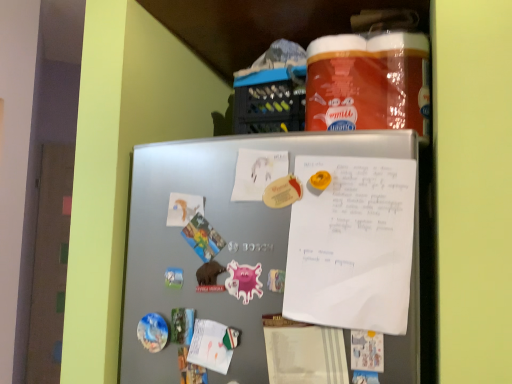
In order to face white paper at upper center, should I rotate leftwards or rightwards?

You should rotate right by 12.369 degrees.

What is the approximate height of white matte paper at upper left, which is the 1th paper in left-to-right order?

The height of white matte paper at upper left, which is the 1th paper in left-to-right order, is 3.08 inches.

Image resolution: width=512 pixels, height=384 pixels. I want to click on white matte paper at upper left, which is the 1th paper in left-to-right order, so click(x=183, y=208).

You are a GUI agent. You are given a task and a screenshot of the screen. Output one action in this format:
    pyautogui.click(x=<x>, y=<y>)
    Task: Click on the white matte paper at center, the 1th paper when ordered from top to bottom
    
    Given the screenshot: What is the action you would take?
    pyautogui.click(x=257, y=172)

You are a GUI agent. You are given a task and a screenshot of the screen. Output one action in this format:
    pyautogui.click(x=<x>, y=<y>)
    Task: Click on the white paper at upper center
    This screenshot has width=512, height=384.
    Given the screenshot: What is the action you would take?
    pyautogui.click(x=352, y=244)

From the image's perspective, between satin silver fridge at center and white paper at upper center, which one is located above?

white paper at upper center appears higher in the image.

Relative to white paper at upper center, is satin silver fridge at center in front or behind?

satin silver fridge at center is positioned closer to the viewer than white paper at upper center.

Are satin silver fridge at center and white paper at upper center beside each other?

There is a gap between satin silver fridge at center and white paper at upper center.

Is satin silver fridge at center spatially inside white paper at upper center, or outside of it?

satin silver fridge at center exists outside the volume of white paper at upper center.

Is the position of white matte paper at center, the 1th paper when ordered from top to bottom, less distant than that of white matte paper at upper left, which is the 1th paper in left-to-right order?

Yes, white matte paper at center, the 1th paper when ordered from top to bottom, is closer to the camera.

Image resolution: width=512 pixels, height=384 pixels. I want to click on paper that is in front of the white matte paper at upper left, which is counted as the 1th paper, starting from the bottom, so click(257, 172).

In the scene shown: Measure the distance from white matte paper at center, acting as the 2th paper starting from the left, to white matte paper at upper left, the 2th paper when ordered from top to bottom.

The distance of white matte paper at center, acting as the 2th paper starting from the left, from white matte paper at upper left, the 2th paper when ordered from top to bottom, is 4.84 inches.

Are white matte paper at center, acting as the second paper starting from the bottom, and white matte paper at upper left, which is the 1th paper in left-to-right order, located far from each other?

No, there isn't a large distance between white matte paper at center, acting as the second paper starting from the bottom, and white matte paper at upper left, which is the 1th paper in left-to-right order.

Does white matte paper at center, the 1th paper when ordered from top to bottom, have a smaller size compared to satin silver fridge at center?

Yes.

Does white matte paper at center, the 1th paper when ordered from top to bottom, lie behind satin silver fridge at center?

That is True.

Is white matte paper at center, the 1th paper when ordered from top to bottom, looking in the opposite direction of satin silver fridge at center?

Yes, white matte paper at center, the 1th paper when ordered from top to bottom,'s orientation is away from satin silver fridge at center.

Is white paper at upper center shorter than white matte paper at upper left, which is counted as the 1th paper, starting from the bottom?

No.

Are white paper at upper center and white matte paper at upper left, the 2th paper when ordered from top to bottom, beside each other?

No, white paper at upper center is not in contact with white matte paper at upper left, the 2th paper when ordered from top to bottom.

Is white matte paper at upper left, which is counted as the 1th paper, starting from the bottom, at the back of white paper at upper center?

That's not correct — white paper at upper center is not looking away from white matte paper at upper left, which is counted as the 1th paper, starting from the bottom.

From a real-world perspective, is white paper at upper center physically located above or below white matte paper at upper left, which appears as the second paper when viewed from the right?

white paper at upper center is below white matte paper at upper left, which appears as the second paper when viewed from the right.

In the scene shown: Is white paper at upper center taller than white matte paper at center, the 1th paper when ordered from top to bottom?

Yes.

Which is farther, (385, 214) or (245, 177)?

Positioned behind is point (245, 177).

Who is more distant, white paper at upper center or white matte paper at center, acting as the second paper starting from the bottom?

white matte paper at center, acting as the second paper starting from the bottom, is further from the camera.

Considering the sizes of objects white matte paper at upper left, the 2th paper when ordered from top to bottom, and white matte paper at center, acting as the 2th paper starting from the left, in the image provided, who is wider, white matte paper at upper left, the 2th paper when ordered from top to bottom, or white matte paper at center, acting as the 2th paper starting from the left,?

white matte paper at upper left, the 2th paper when ordered from top to bottom, is wider.

Who is more distant, white matte paper at upper left, which is counted as the 1th paper, starting from the bottom, or white matte paper at center, acting as the second paper starting from the bottom?

white matte paper at upper left, which is counted as the 1th paper, starting from the bottom, is more distant.

From a real-world perspective, is white matte paper at upper left, which is the 1th paper in left-to-right order, positioned above or below white matte paper at center, acting as the second paper starting from the bottom?

In terms of real-world spatial position, white matte paper at upper left, which is the 1th paper in left-to-right order, is below white matte paper at center, acting as the second paper starting from the bottom.

Is white matte paper at upper left, which appears as the second paper when viewed from the right, turned away from white matte paper at center, the first paper from the right?

No, white matte paper at center, the first paper from the right, is not at the back of white matte paper at upper left, which appears as the second paper when viewed from the right.

Looking at this image, considering the sizes of white paper at upper center and satin silver fridge at center in the image, is white paper at upper center bigger or smaller than satin silver fridge at center?

Clearly, white paper at upper center is smaller in size than satin silver fridge at center.

Which is in front, white paper at upper center or satin silver fridge at center?

satin silver fridge at center is closer to the camera.

From the image's perspective, would you say white paper at upper center is positioned over satin silver fridge at center?

Indeed, from the image's perspective, white paper at upper center is shown above satin silver fridge at center.

Could you tell me if white paper at upper center is facing satin silver fridge at center?

Answer: Yes, white paper at upper center is oriented towards satin silver fridge at center.

Where is `refrigerator below the white paper at upper center (from a real-world perspective)`? The width and height of the screenshot is (512, 384). refrigerator below the white paper at upper center (from a real-world perspective) is located at coordinates click(221, 234).

Locate an element on the screen. Image resolution: width=512 pixels, height=384 pixels. paper on the right of white matte paper at upper left, which is the 1th paper in left-to-right order is located at coordinates (257, 172).

Estimate the real-world distances between objects in this image. Which object is closer to white paper at upper center, white matte paper at center, the 1th paper when ordered from top to bottom, or satin silver fridge at center?

satin silver fridge at center lies closer to white paper at upper center than the other object.

Looking at the image, which one is located further to white matte paper at center, the first paper from the right, white matte paper at upper left, which is the 1th paper in left-to-right order, or satin silver fridge at center?

satin silver fridge at center is further to white matte paper at center, the first paper from the right.

Considering their positions, is white matte paper at upper left, which is counted as the 1th paper, starting from the bottom, positioned closer to white paper at upper center than white matte paper at center, acting as the 2th paper starting from the left?

white matte paper at center, acting as the 2th paper starting from the left, is positioned closer to the anchor white paper at upper center.

When comparing their distances from white matte paper at center, the 1th paper when ordered from top to bottom, does white matte paper at upper left, which is counted as the 1th paper, starting from the bottom, or white paper at upper center seem closer?

The object closer to white matte paper at center, the 1th paper when ordered from top to bottom, is white matte paper at upper left, which is counted as the 1th paper, starting from the bottom.

Estimate the real-world distances between objects in this image. Which object is closer to white paper at upper center, satin silver fridge at center or white matte paper at upper left, which is the 1th paper in left-to-right order?

satin silver fridge at center is positioned closer to the anchor white paper at upper center.

Looking at the image, which one is located closer to white matte paper at upper left, which appears as the second paper when viewed from the right, white matte paper at center, the 1th paper when ordered from top to bottom, or satin silver fridge at center?

Among the two, white matte paper at center, the 1th paper when ordered from top to bottom, is located nearer to white matte paper at upper left, which appears as the second paper when viewed from the right.

Considering their positions, is white matte paper at center, the 1th paper when ordered from top to bottom, positioned further to white matte paper at upper left, which is counted as the 1th paper, starting from the bottom, than white paper at upper center?

white paper at upper center.

Considering their positions, is satin silver fridge at center positioned closer to white matte paper at center, acting as the second paper starting from the bottom, than white matte paper at upper left, which is counted as the 1th paper, starting from the bottom?

white matte paper at upper left, which is counted as the 1th paper, starting from the bottom, is closer to white matte paper at center, acting as the second paper starting from the bottom.

Identify the location of poster between white matte paper at center, the first paper from the right, and satin silver fridge at center from top to bottom. Image resolution: width=512 pixels, height=384 pixels. (352, 244).

Where is `paper between white matte paper at upper left, which appears as the second paper when viewed from the right, and white paper at upper center from left to right`? Image resolution: width=512 pixels, height=384 pixels. paper between white matte paper at upper left, which appears as the second paper when viewed from the right, and white paper at upper center from left to right is located at coordinates (257, 172).

At what (x,y) coordinates should I click in order to perform the action: click on paper between satin silver fridge at center and white matte paper at upper left, which is the 1th paper in left-to-right order, from front to back. Please return your answer as a coordinate pair (x, y). The image size is (512, 384). Looking at the image, I should click on (257, 172).

Find the location of a particular element. The image size is (512, 384). refrigerator situated between white matte paper at upper left, the 2th paper when ordered from top to bottom, and white paper at upper center from left to right is located at coordinates (221, 234).